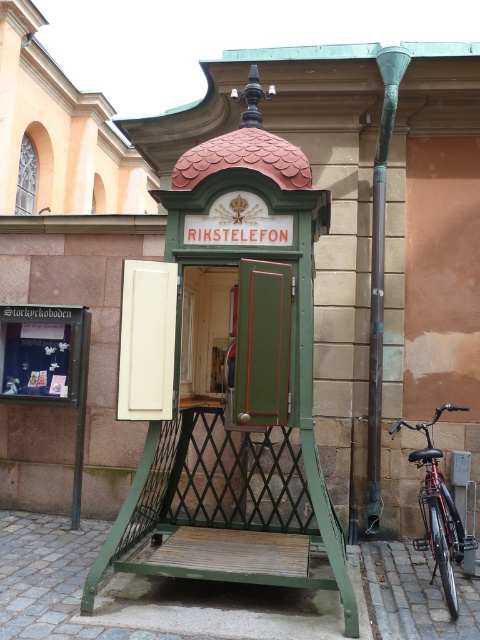
You are a delivery person trying to park your 1.5 meter wide delivery cart between the green patinated metal pole at right and the shiny black bicycle at lower right. Can you fit your cart between them without touching either object?

The distance between the green patinated metal pole at right and the shiny black bicycle at lower right is 2.84 meters. Subtracting the width of the cart, which is 1.5 meters, leaves 1.34 meters of space. Since this remaining space is more than zero, the cart can fit between them without touching either object.

You are a delivery person trying to park your shiny black bicycle at lower right near the green patinated metal pole at right. Can you fit your bicycle next to the pole without moving the pole?

The green patinated metal pole at right is smaller than the shiny black bicycle at lower right, so there should be enough space to park the shiny black bicycle at lower right next to the pole without moving it.

You are standing in front of the vintage telephone booth and notice two points marked on its structure. Which point, point (266, 193) or point (420, 499), is closer to you?

Point (266, 193) is closer to the viewer than point (420, 499).